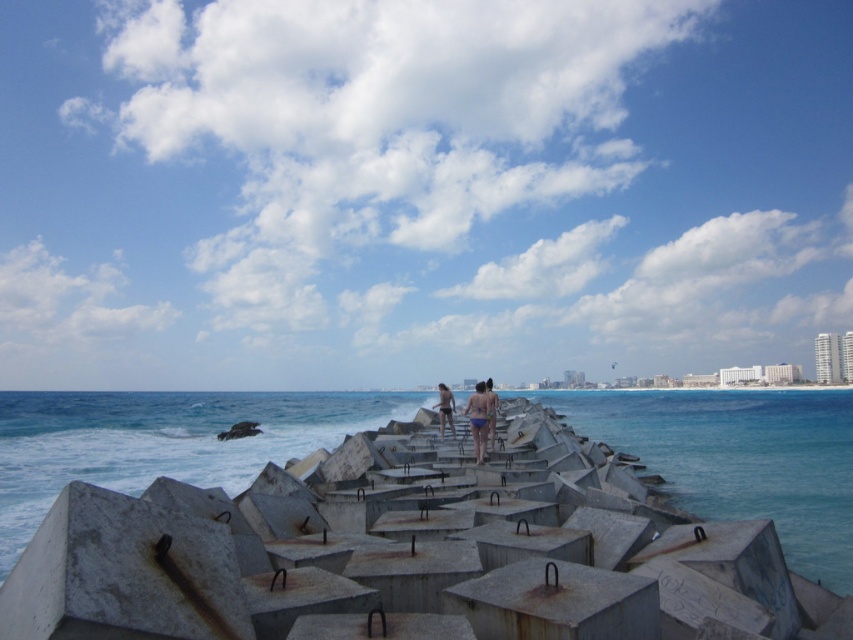
Question: Which of these objects is positioned closest to the matte blue bikini at center?

Choices:
 (A) matte gray concrete at center
 (B) rusty concrete water at center

Answer: (A)

Question: Does matte gray concrete at center have a lesser width compared to blue swimsuit at center?

Choices:
 (A) yes
 (B) no

Answer: (A)

Question: Which object is positioned farthest from the rusty concrete water at center?

Choices:
 (A) matte blue bikini at center
 (B) matte gray concrete at center
 (C) blue concrete water at center
 (D) blue swimsuit at center

Answer: (A)

Question: Which point is farther to the camera?

Choices:
 (A) 469,406
 (B) 488,442
 (C) 440,440
 (D) 244,460

Answer: (D)

Question: From the image, what is the correct spatial relationship of rusty concrete water at center in relation to blue swimsuit at center?

Choices:
 (A) above
 (B) below

Answer: (B)

Question: Is blue concrete water at center below matte blue bikini at center?

Choices:
 (A) yes
 (B) no

Answer: (A)